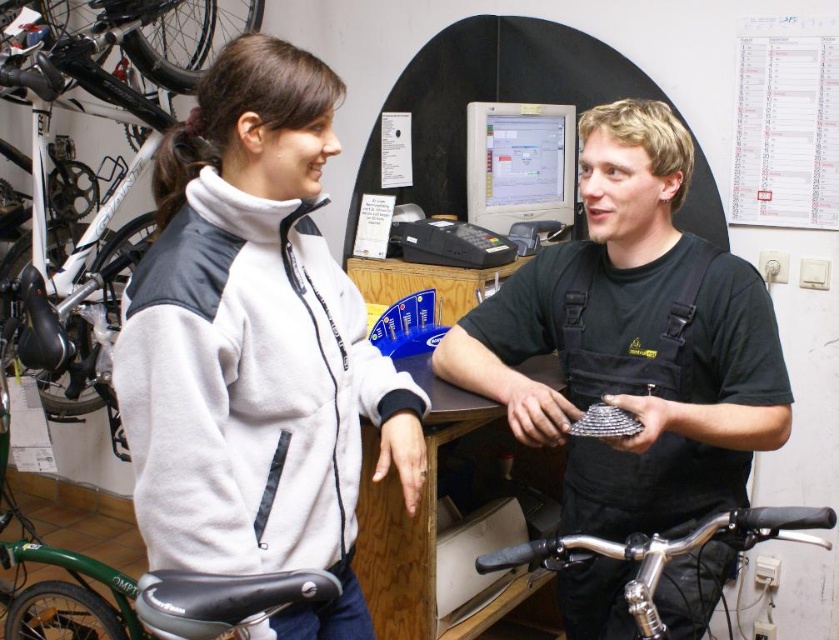
Can you confirm if black matte uniform at center is shorter than polished chrome handlebars at lower center?

No, black matte uniform at center is not shorter than polished chrome handlebars at lower center.

At what (x,y) coordinates should I click in order to perform the action: click on black matte uniform at center. Please return your answer as a coordinate pair (x, y). This screenshot has height=640, width=839. Looking at the image, I should click on (634, 340).

Between matte gray monitor at center and polished chrome handlebars at lower center, which one has more height?

matte gray monitor at center

Who is more distant from viewer, (472, 161) or (686, 547)?

The point (472, 161) is more distant.

Who is more distant from viewer, (560, 124) or (654, 561)?

Point (560, 124)

Locate an element on the screen. The height and width of the screenshot is (640, 839). matte gray monitor at center is located at coordinates (519, 163).

Is point (457, 326) closer to camera compared to point (468, 148)?

Yes.

Which is in front, point (608, 227) or point (477, 148)?

Point (608, 227)

Is point (624, 243) farther from viewer compared to point (545, 129)?

No, (624, 243) is closer to viewer.

The image size is (839, 640). Find the location of `black matte uniform at center`. black matte uniform at center is located at coordinates coord(634,340).